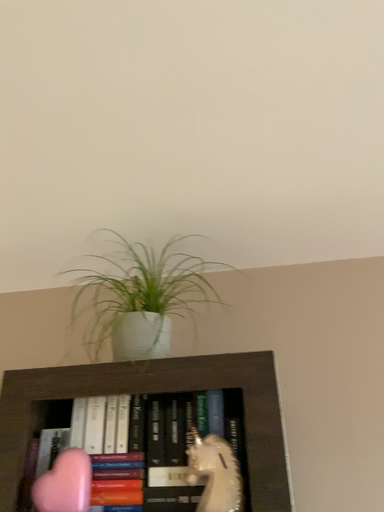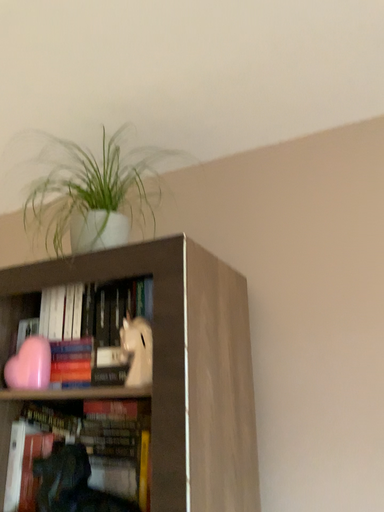
Question: How did the camera likely rotate when shooting the video?

Choices:
 (A) rotated upward
 (B) rotated downward

Answer: (B)